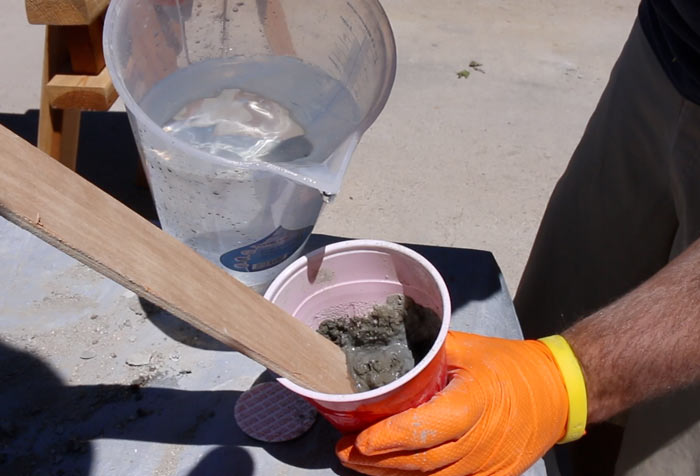
You are a GUI agent. You are given a task and a screenshot of the screen. Output one action in this format:
    pyautogui.click(x=<x>, y=<y>)
    Task: Click on the red paper cups
    
    Given the screenshot: What is the action you would take?
    pyautogui.click(x=413, y=389)